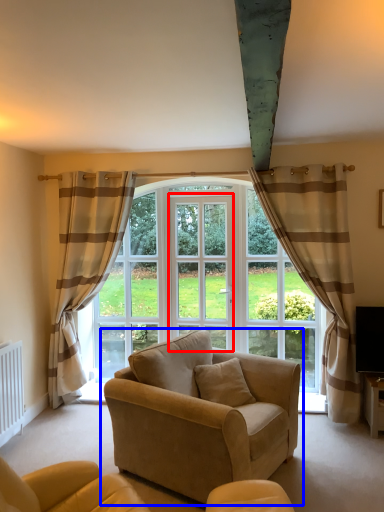
Question: Which point is closer to the camera, screen door (highlighted by a red box) or studio couch (highlighted by a blue box)?

Choices:
 (A) screen door
 (B) studio couch

Answer: (B)